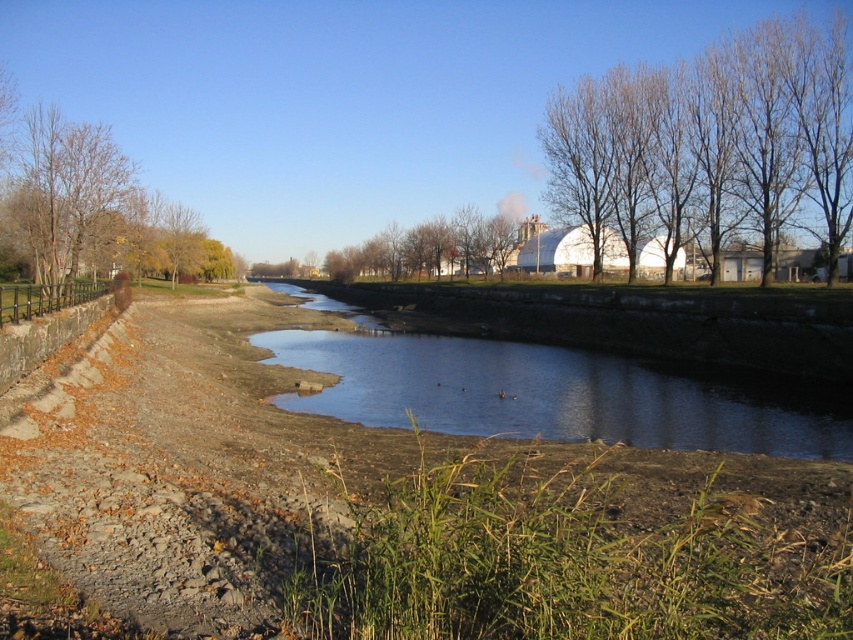
Question: Among these objects, which one is nearest to the camera?

Choices:
 (A) bare branches at upper right
 (B) clear water at center
 (C) brown leafy tree at center
 (D) brown leafy tree at left

Answer: (B)

Question: Does bare branches at upper right have a greater width compared to brown leafy tree at center?

Choices:
 (A) yes
 (B) no

Answer: (B)

Question: Which object is the farthest from the clear water at center?

Choices:
 (A) brown leafy tree at left
 (B) bare branches at upper right
 (C) brown leafy tree at center

Answer: (C)

Question: Does brown leafy tree at left appear on the left side of brown leafy tree at center?

Choices:
 (A) no
 (B) yes

Answer: (B)

Question: Does brown leafy tree at left lie in front of brown leafy tree at center?

Choices:
 (A) yes
 (B) no

Answer: (A)

Question: Which object is closer to the camera taking this photo?

Choices:
 (A) bare branches at upper right
 (B) brown leafy tree at left
 (C) brown leafy tree at center

Answer: (B)